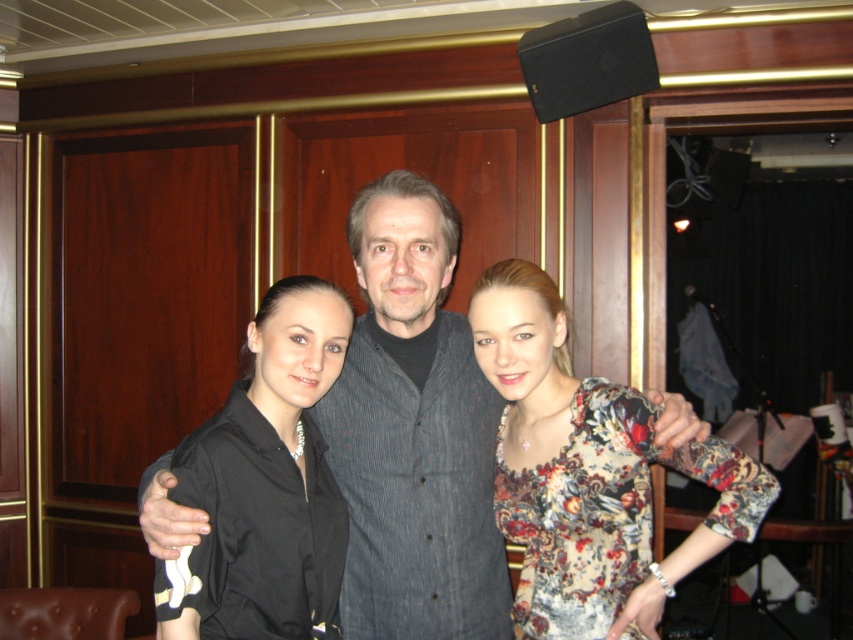
Question: Is floral print blouse at center closer to camera compared to black satin blouse at center?

Choices:
 (A) yes
 (B) no

Answer: (B)

Question: Among these points, which one is nearest to the camera?

Choices:
 (A) (714, 513)
 (B) (279, 589)
 (C) (456, 401)

Answer: (B)

Question: Which of the following is the farthest from the observer?

Choices:
 (A) black satin blouse at center
 (B) floral print blouse at center
 (C) dark gray textured shirt at center

Answer: (C)

Question: Which point is farther from the camera taking this photo?

Choices:
 (A) [x=699, y=468]
 (B) [x=233, y=586]
 (C) [x=395, y=241]

Answer: (C)

Question: Is floral print blouse at center to the left of black satin blouse at center from the viewer's perspective?

Choices:
 (A) yes
 (B) no

Answer: (B)

Question: Can you confirm if dark gray textured shirt at center is positioned above floral print blouse at center?

Choices:
 (A) yes
 (B) no

Answer: (A)